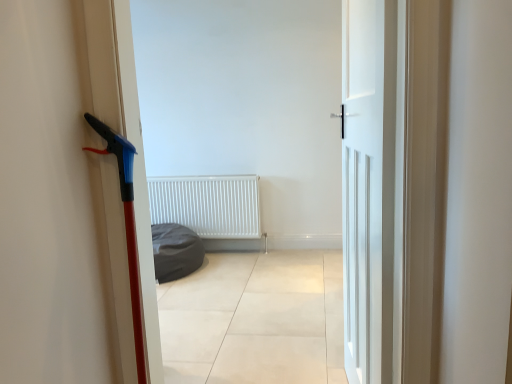
Locate an element on the screen. This screenshot has height=384, width=512. white matte door at center is located at coordinates (368, 186).

Find the location of a particular element. This screenshot has width=512, height=384. white matte door at center is located at coordinates (368, 186).

Is white matte door at center inside the boundaries of white matte radiator at center, or outside?

white matte door at center exists outside the volume of white matte radiator at center.

Is white matte door at center not near white matte radiator at center?

Absolutely, white matte door at center is distant from white matte radiator at center.

Is dark gray fabric beanbag at center positioned in front of white matte radiator at center?

That is True.

Is dark gray fabric beanbag at center taller or shorter than white matte radiator at center?

In the image, dark gray fabric beanbag at center appears to be shorter than white matte radiator at center.

Which object is positioned more to the right, dark gray fabric beanbag at center or white matte radiator at center?

white matte radiator at center.

Could you tell me if dark gray fabric beanbag at center is facing white matte radiator at center?

No.

Who is bigger, white matte radiator at center or white matte door at center?

white matte door at center is bigger.

Would you say white matte radiator at center is outside white matte door at center?

white matte radiator at center is positioned outside white matte door at center.

What are the coordinates of `door in front of the white matte radiator at center` in the screenshot? It's located at (368, 186).

From the image's perspective, which one is positioned lower, dark gray fabric beanbag at center or white matte door at center?

dark gray fabric beanbag at center appears lower in the image.

How many degrees apart are the facing directions of dark gray fabric beanbag at center and white matte door at center?

dark gray fabric beanbag at center and white matte door at center are facing 83.7 degrees away from each other.

Is dark gray fabric beanbag at center next to white matte door at center?

dark gray fabric beanbag at center and white matte door at center are clearly separated.

From a real-world perspective, is dark gray fabric beanbag at center under white matte door at center?

Yes, from a real-world perspective, dark gray fabric beanbag at center is beneath white matte door at center.

Measure the distance from white matte radiator at center to dark gray fabric beanbag at center.

The distance of white matte radiator at center from dark gray fabric beanbag at center is 16.77 inches.

Is white matte radiator at center turned away from dark gray fabric beanbag at center?

No, white matte radiator at center's orientation is not away from dark gray fabric beanbag at center.

Between white matte radiator at center and dark gray fabric beanbag at center, which one appears on the right side from the viewer's perspective?

white matte radiator at center is more to the right.

Is there a large distance between white matte radiator at center and dark gray fabric beanbag at center?

No, there isn't a large distance between white matte radiator at center and dark gray fabric beanbag at center.

Which point is more distant from viewer, [349,97] or [163,242]?

Point [163,242]

Is white matte door at center shorter than dark gray fabric beanbag at center?

In fact, white matte door at center may be taller than dark gray fabric beanbag at center.

Is white matte door at center to the left of dark gray fabric beanbag at center from the viewer's perspective?

Incorrect, white matte door at center is not on the left side of dark gray fabric beanbag at center.

Is white matte door at center facing towards dark gray fabric beanbag at center?

No, white matte door at center is not aimed at dark gray fabric beanbag at center.

Find the location of a particular element. The image size is (512, 384). door lying on the right of white matte radiator at center is located at coordinates (368, 186).

You are a GUI agent. You are given a task and a screenshot of the screen. Output one action in this format:
    pyautogui.click(x=<x>, y=<y>)
    Task: Click on the sleeping bag on the left of white matte radiator at center
    
    Given the screenshot: What is the action you would take?
    pyautogui.click(x=175, y=251)

From the image, which object appears to be nearer to dark gray fabric beanbag at center, white matte door at center or white matte radiator at center?

white matte radiator at center.

From the picture: Which object lies nearer to the anchor point white matte radiator at center, white matte door at center or dark gray fabric beanbag at center?

Based on the image, dark gray fabric beanbag at center appears to be nearer to white matte radiator at center.

From the image, which object appears to be nearer to dark gray fabric beanbag at center, white matte radiator at center or white matte door at center?

white matte radiator at center lies closer to dark gray fabric beanbag at center than the other object.

In the scene shown: Estimate the real-world distances between objects in this image. Which object is closer to white matte door at center, dark gray fabric beanbag at center or white matte radiator at center?

dark gray fabric beanbag at center.

Based on their spatial positions, is dark gray fabric beanbag at center or white matte door at center further from white matte radiator at center?

Among the two, white matte door at center is located further to white matte radiator at center.

Estimate the real-world distances between objects in this image. Which object is closer to white matte door at center, white matte radiator at center or dark gray fabric beanbag at center?

Among the two, dark gray fabric beanbag at center is located nearer to white matte door at center.

The width and height of the screenshot is (512, 384). In order to click on sleeping bag located between white matte door at center and white matte radiator at center in the depth direction in this screenshot , I will do `click(175, 251)`.